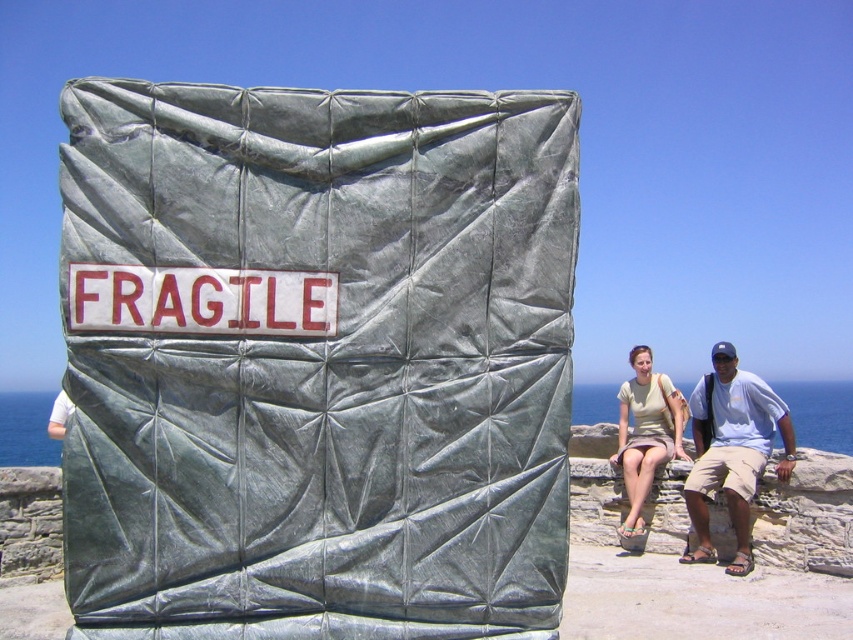
Does white plastic sign at center have a greater height compared to light blue cotton shirt at right?

No.

The height and width of the screenshot is (640, 853). I want to click on white plastic sign at center, so click(201, 300).

Who is more distant from viewer, [299,308] or [659,417]?

The point [659,417] is more distant.

Is point (181, 280) in front of point (672, 403)?

Yes, point (181, 280) is in front of point (672, 403).

Is point (122, 264) positioned after point (670, 428)?

That is False.

This screenshot has width=853, height=640. What are the coordinates of `white plastic sign at center` in the screenshot? It's located at (201, 300).

Does light blue cotton shirt at right have a larger size compared to light green cotton shirt at right?

Correct, light blue cotton shirt at right is larger in size than light green cotton shirt at right.

Between light blue cotton shirt at right and light green cotton shirt at right, which one has more height?

light blue cotton shirt at right

Which is in front, point (706, 413) or point (646, 470)?

Positioned in front is point (646, 470).

Locate an element on the screen. Image resolution: width=853 pixels, height=640 pixels. light blue cotton shirt at right is located at coordinates (732, 451).